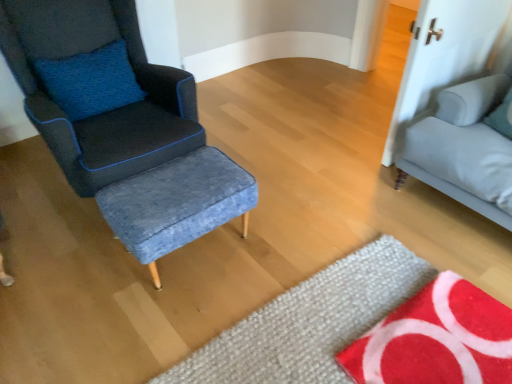
Question: Which direction should I rotate to look at textured wool mat at lower center, positioned as the 2th mat in right-to-left order, — up or down?

Choices:
 (A) down
 (B) up

Answer: (A)

Question: From a real-world perspective, is red textured mat at lower right, the first mat positioned from the right, physically above denim fabric stool at center?

Choices:
 (A) no
 (B) yes

Answer: (A)

Question: From a real-world perspective, does red textured mat at lower right, acting as the second mat starting from the left, sit lower than denim fabric stool at center?

Choices:
 (A) yes
 (B) no

Answer: (A)

Question: Can you confirm if red textured mat at lower right, acting as the second mat starting from the left, is wider than denim fabric stool at center?

Choices:
 (A) no
 (B) yes

Answer: (B)

Question: Could you tell me if red textured mat at lower right, acting as the second mat starting from the left, is turned towards denim fabric stool at center?

Choices:
 (A) yes
 (B) no

Answer: (B)

Question: Is red textured mat at lower right, the first mat positioned from the right, smaller than denim fabric stool at center?

Choices:
 (A) no
 (B) yes

Answer: (B)

Question: Can you confirm if red textured mat at lower right, acting as the second mat starting from the left, is shorter than denim fabric stool at center?

Choices:
 (A) yes
 (B) no

Answer: (A)

Question: From a real-world perspective, is light gray fabric studio couch at right physically above red textured mat at lower right, acting as the second mat starting from the left?

Choices:
 (A) no
 (B) yes

Answer: (B)

Question: Is light gray fabric studio couch at right to the left of red textured mat at lower right, the first mat positioned from the right, from the viewer's perspective?

Choices:
 (A) yes
 (B) no

Answer: (B)

Question: Is light gray fabric studio couch at right positioned far away from red textured mat at lower right, acting as the second mat starting from the left?

Choices:
 (A) yes
 (B) no

Answer: (B)

Question: From the image's perspective, is light gray fabric studio couch at right located beneath red textured mat at lower right, acting as the second mat starting from the left?

Choices:
 (A) no
 (B) yes

Answer: (A)

Question: Is light gray fabric studio couch at right aimed at red textured mat at lower right, acting as the second mat starting from the left?

Choices:
 (A) yes
 (B) no

Answer: (A)

Question: Does light gray fabric studio couch at right have a larger size compared to red textured mat at lower right, acting as the second mat starting from the left?

Choices:
 (A) no
 (B) yes

Answer: (B)

Question: Considering the relative positions of light gray fabric studio couch at right and textured wool mat at lower center, positioned as the 1th mat in left-to-right order, in the image provided, is light gray fabric studio couch at right to the left of textured wool mat at lower center, positioned as the 1th mat in left-to-right order, from the viewer's perspective?

Choices:
 (A) yes
 (B) no

Answer: (B)